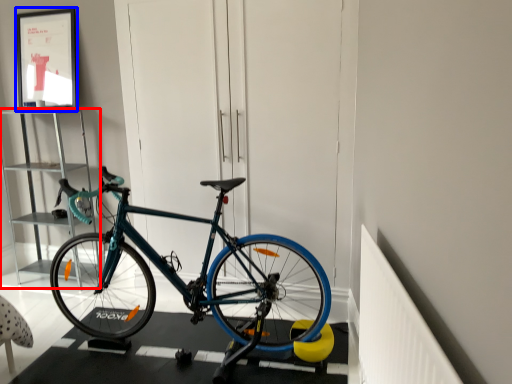
Question: Which object is closer to the camera taking this photo, cabinet (highlighted by a red box) or picture frame (highlighted by a blue box)?

Choices:
 (A) cabinet
 (B) picture frame

Answer: (A)